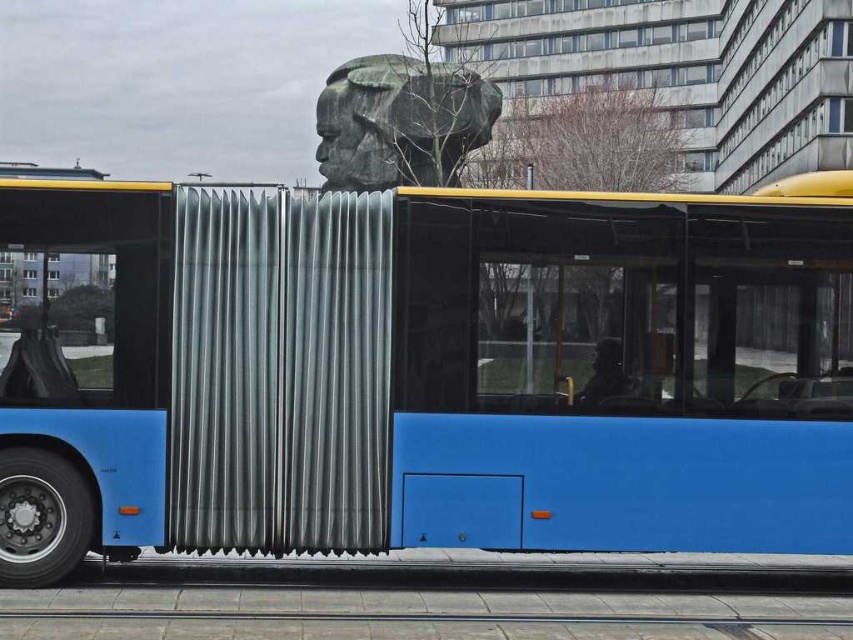
Question: Which point appears farthest from the camera in this image?

Choices:
 (A) (227, 448)
 (B) (421, 184)

Answer: (B)

Question: Which point is farther to the camera?

Choices:
 (A) green patina stone head at upper center
 (B) blue matte bus at center

Answer: (A)

Question: Is blue matte bus at center thinner than green patina stone head at upper center?

Choices:
 (A) yes
 (B) no

Answer: (A)

Question: Does blue matte bus at center appear under green patina stone head at upper center?

Choices:
 (A) no
 (B) yes

Answer: (B)

Question: Considering the relative positions of blue matte bus at center and green patina stone head at upper center in the image provided, where is blue matte bus at center located with respect to green patina stone head at upper center?

Choices:
 (A) right
 (B) left

Answer: (A)